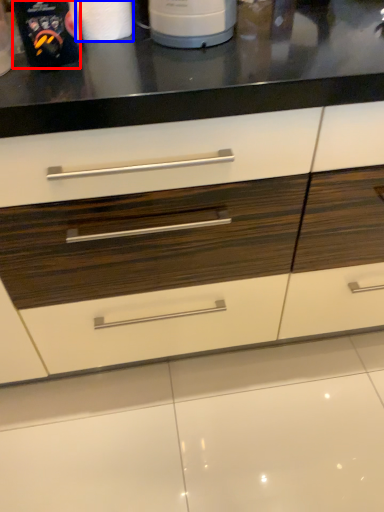
Question: Among these objects, which one is nearest to the camera, kitchen appliance (highlighted by a red box) or paper towel (highlighted by a blue box)?

Choices:
 (A) kitchen appliance
 (B) paper towel

Answer: (A)